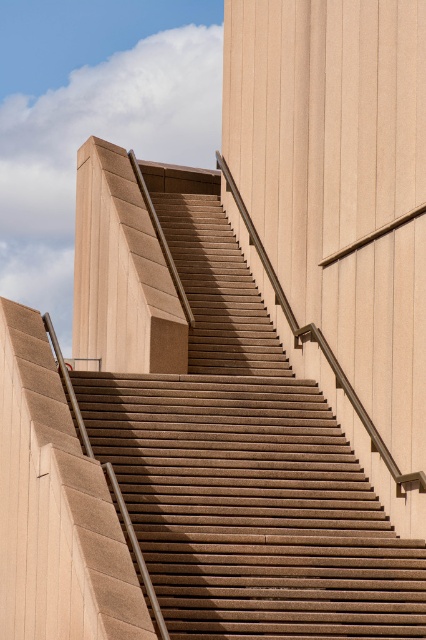
Does brown textured stairs at center have a lesser width compared to sandy beige concrete pillar at upper left?

In fact, brown textured stairs at center might be wider than sandy beige concrete pillar at upper left.

Is brown textured stairs at center above sandy beige concrete pillar at upper left?

Incorrect, brown textured stairs at center is not positioned above sandy beige concrete pillar at upper left.

Is point (242, 269) closer to camera compared to point (88, 320)?

Yes, point (242, 269) is closer to viewer.

Identify the location of brown textured stairs at center. (247, 470).